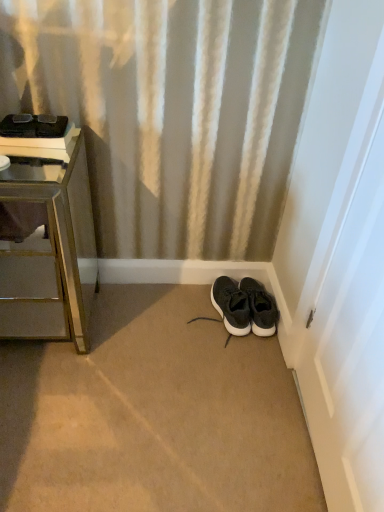
I want to click on blank area to the left of black suede sneakers at lower right, which is counted as the 1th footwear, starting from the right, so click(x=202, y=313).